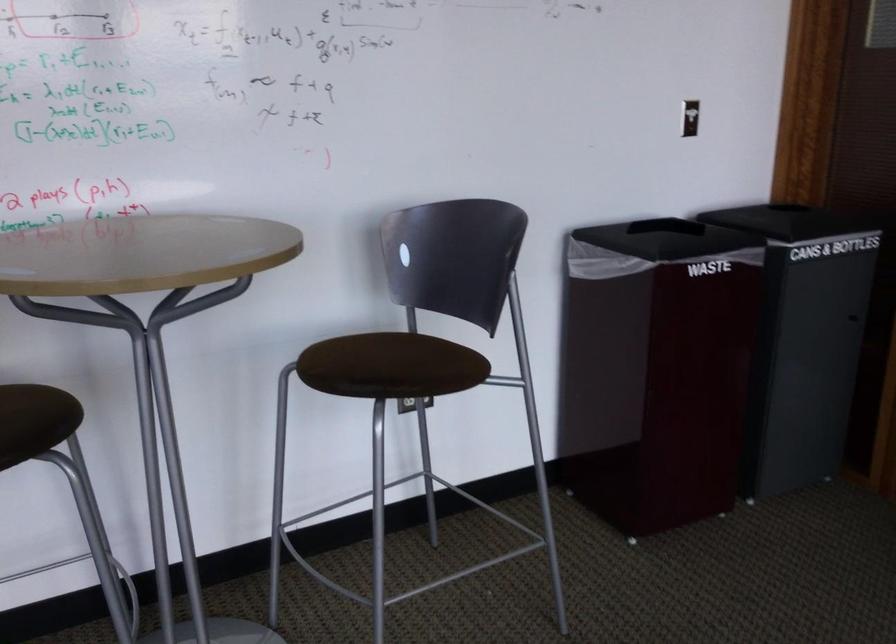
The width and height of the screenshot is (896, 644). What do you see at coordinates (667, 239) in the screenshot? I see `a black trash can lid` at bounding box center [667, 239].